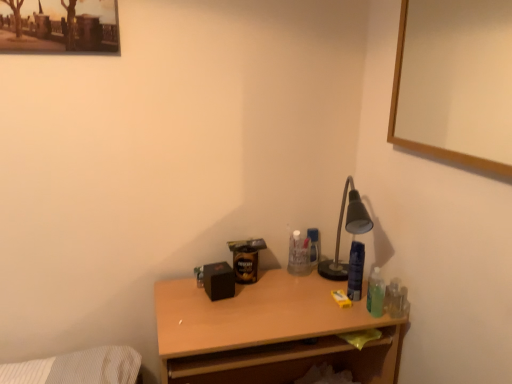
This screenshot has height=384, width=512. What do you see at coordinates (455, 82) in the screenshot?
I see `wooden picture frame at upper right` at bounding box center [455, 82].

Find the location of `wooden picture frame at upper right`. wooden picture frame at upper right is located at coordinates (455, 82).

The width and height of the screenshot is (512, 384). In order to click on wooden desk at center in this screenshot , I will do `click(268, 332)`.

In order to face wooden desk at center, should I rotate leftwards or rightwards?

Turn right by 2.205 degrees to look at wooden desk at center.

The image size is (512, 384). What do you see at coordinates (268, 332) in the screenshot? I see `wooden desk at center` at bounding box center [268, 332].

You are a GUI agent. You are given a task and a screenshot of the screen. Output one action in this format:
    pyautogui.click(x=<x>, y=<y>)
    Task: Click on the wooden picture frame at upper right
    
    Given the screenshot: What is the action you would take?
    pyautogui.click(x=455, y=82)

Considering the relative positions of wooden desk at center and wooden picture frame at upper right in the image provided, is wooden desk at center to the left or to the right of wooden picture frame at upper right?

wooden desk at center is positioned on wooden picture frame at upper right's left side.

Is the position of wooden desk at center less distant than that of wooden picture frame at upper right?

No.

Is point (283, 305) behind point (397, 143)?

Yes, it is behind point (397, 143).

From the image's perspective, is wooden desk at center located above wooden picture frame at upper right?

No.

From a real-world perspective, is wooden desk at center located higher than wooden picture frame at upper right?

No, from a real-world perspective, wooden desk at center is not on top of wooden picture frame at upper right.

Is wooden desk at center thinner than wooden picture frame at upper right?

In fact, wooden desk at center might be wider than wooden picture frame at upper right.

Can you confirm if wooden desk at center is taller than wooden picture frame at upper right?

Yes, wooden desk at center is taller than wooden picture frame at upper right.

Can you confirm if wooden desk at center is smaller than wooden picture frame at upper right?

Actually, wooden desk at center might be larger than wooden picture frame at upper right.

Which is correct: wooden desk at center is inside wooden picture frame at upper right, or outside of it?

wooden desk at center is outside wooden picture frame at upper right.

Is wooden desk at center far from wooden picture frame at upper right?

wooden desk at center is actually quite close to wooden picture frame at upper right.

Is wooden desk at center looking in the opposite direction of wooden picture frame at upper right?

No, wooden desk at center is not facing away from wooden picture frame at upper right.

Locate an element on the screen. The height and width of the screenshot is (384, 512). picture frame above the wooden desk at center (from a real-world perspective) is located at coordinates (455, 82).

Which object is positioned more to the left, wooden picture frame at upper right or wooden desk at center?

wooden desk at center.

Is wooden picture frame at upper right in front of or behind wooden desk at center in the image?

In the image, wooden picture frame at upper right appears in front of wooden desk at center.

Considering the points (471, 150) and (381, 377), which point is behind, point (471, 150) or point (381, 377)?

The point (471, 150) is more distant.

From the image's perspective, between wooden picture frame at upper right and wooden desk at center, who is located below?

wooden desk at center appears lower in the image.

From a real-world perspective, is wooden picture frame at upper right on top of wooden desk at center?

Yes, from a real-world perspective, wooden picture frame at upper right is on top of wooden desk at center.

Is wooden picture frame at upper right wider or thinner than wooden desk at center?

Considering their sizes, wooden picture frame at upper right looks slimmer than wooden desk at center.

Who is shorter, wooden picture frame at upper right or wooden desk at center?

Standing shorter between the two is wooden picture frame at upper right.

Looking at this image, considering the relative sizes of wooden picture frame at upper right and wooden desk at center in the image provided, is wooden picture frame at upper right smaller than wooden desk at center?

Correct, wooden picture frame at upper right occupies less space than wooden desk at center.

Is wooden picture frame at upper right outside of wooden desk at center?

Absolutely, wooden picture frame at upper right is external to wooden desk at center.

Is wooden picture frame at upper right not near wooden desk at center?

Actually, wooden picture frame at upper right and wooden desk at center are a little close together.

Could you tell me if wooden picture frame at upper right is turned towards wooden desk at center?

No, wooden picture frame at upper right is not facing towards wooden desk at center.

What's the angular difference between wooden picture frame at upper right and wooden desk at center's facing directions?

The facing directions of wooden picture frame at upper right and wooden desk at center are 90.5 degrees apart.

At what (x,y) coordinates should I click in order to perform the action: click on picture frame that appears above the wooden desk at center (from a real-world perspective). Please return your answer as a coordinate pair (x, y). This screenshot has width=512, height=384. Looking at the image, I should click on (455, 82).

The width and height of the screenshot is (512, 384). I want to click on desk beneath the wooden picture frame at upper right (from a real-world perspective), so click(x=268, y=332).

You are a GUI agent. You are given a task and a screenshot of the screen. Output one action in this format:
    pyautogui.click(x=<x>, y=<y>)
    Task: Click on the desk behind the wooden picture frame at upper right
    Image resolution: width=512 pixels, height=384 pixels.
    Given the screenshot: What is the action you would take?
    pyautogui.click(x=268, y=332)